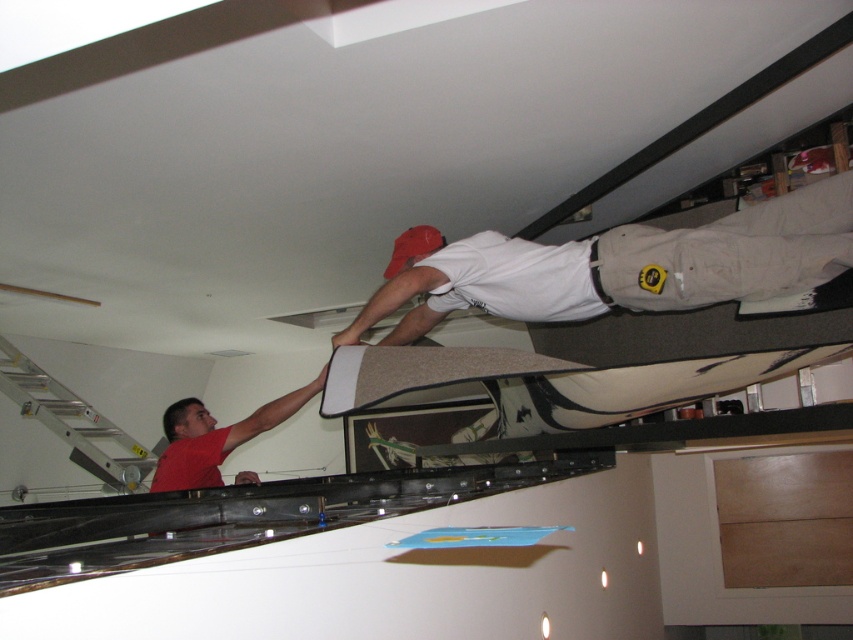
You are standing in the kitchen and see the white matte shirt at upper center and the red matte shirt at lower left. Which person is shorter in height?

The white matte shirt at upper center is shorter than the red matte shirt at lower left.

You are standing in the room and want to place a new lamp between the two points, point (573, 284) and point (198, 454). Which point should the lamp be closer to in order to be closer to the viewer?

The lamp should be placed closer to point (573, 284) because it is closer to the viewer than point (198, 454).